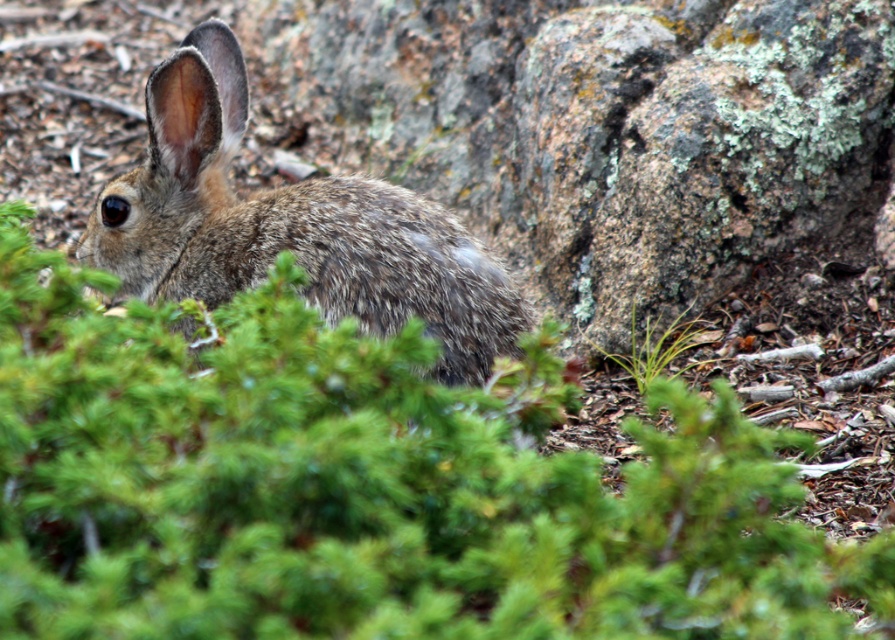
Does fuzzy brown rabbit at center have a larger size compared to green leafy plant at center?

Indeed, fuzzy brown rabbit at center has a larger size compared to green leafy plant at center.

Can you confirm if fuzzy brown rabbit at center is positioned to the right of green leafy plant at center?

Incorrect, fuzzy brown rabbit at center is not on the right side of green leafy plant at center.

Is point (355, 292) less distant than point (635, 312)?

Yes.

Locate an element on the screen. The height and width of the screenshot is (640, 895). fuzzy brown rabbit at center is located at coordinates (290, 227).